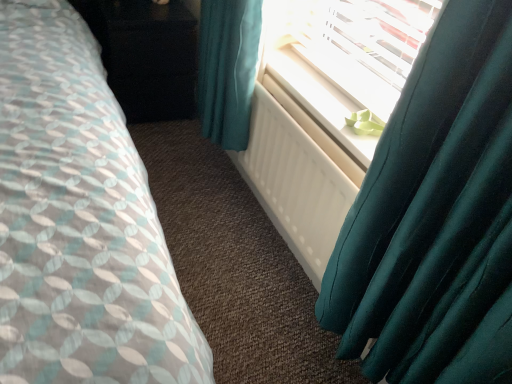
Question: Is black glossy dresser at upper left completely or partially inside white matte radiator at center?

Choices:
 (A) no
 (B) yes

Answer: (A)

Question: Is white matte radiator at center facing away from black glossy dresser at upper left?

Choices:
 (A) no
 (B) yes

Answer: (A)

Question: Considering the relative positions of white matte radiator at center and black glossy dresser at upper left in the image provided, is white matte radiator at center behind black glossy dresser at upper left?

Choices:
 (A) no
 (B) yes

Answer: (A)

Question: Would you say white matte radiator at center is outside black glossy dresser at upper left?

Choices:
 (A) yes
 (B) no

Answer: (A)

Question: From a real-world perspective, is white matte radiator at center on black glossy dresser at upper left?

Choices:
 (A) no
 (B) yes

Answer: (B)

Question: Can you confirm if white matte radiator at center is positioned to the left of black glossy dresser at upper left?

Choices:
 (A) no
 (B) yes

Answer: (A)

Question: Is black glossy dresser at upper left taller than white plastic radiator at upper center?

Choices:
 (A) yes
 (B) no

Answer: (A)

Question: Can you confirm if black glossy dresser at upper left is bigger than white plastic radiator at upper center?

Choices:
 (A) yes
 (B) no

Answer: (A)

Question: Is black glossy dresser at upper left to the right of white plastic radiator at upper center from the viewer's perspective?

Choices:
 (A) no
 (B) yes

Answer: (A)

Question: Is black glossy dresser at upper left not within white plastic radiator at upper center?

Choices:
 (A) yes
 (B) no

Answer: (A)

Question: From the image's perspective, is black glossy dresser at upper left over white plastic radiator at upper center?

Choices:
 (A) no
 (B) yes

Answer: (B)

Question: Does black glossy dresser at upper left lie behind white plastic radiator at upper center?

Choices:
 (A) yes
 (B) no

Answer: (A)

Question: Can you confirm if teal satin curtain at right is thinner than black glossy dresser at upper left?

Choices:
 (A) no
 (B) yes

Answer: (B)